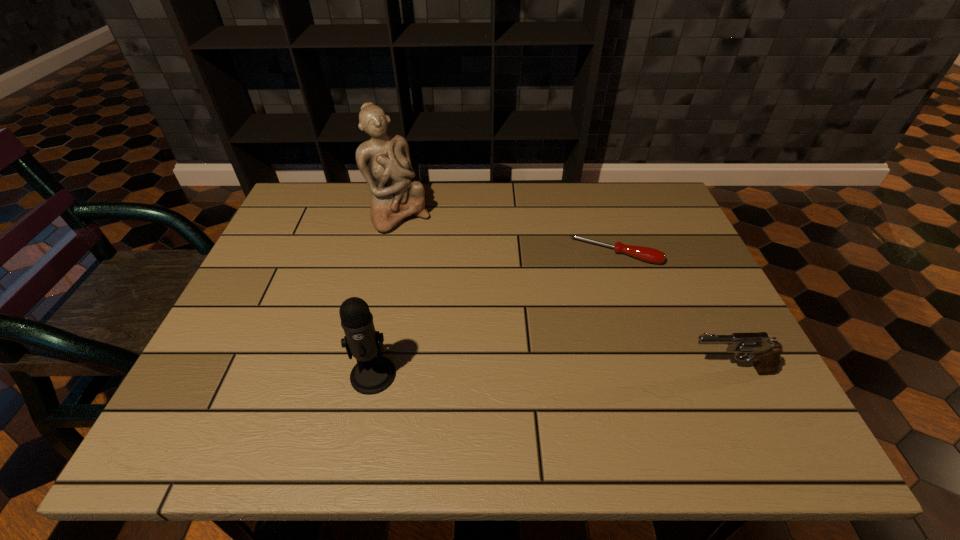
This screenshot has height=540, width=960. What are the coordinates of `vacant position located 0.310m at the tip of the shortest object` in the screenshot? It's located at (571, 357).

Locate an element on the screen. free space located at the tip of the shortest object is located at coordinates (588, 308).

Image resolution: width=960 pixels, height=540 pixels. Identify the location of vacant region located at the tip of the shortest object. (591, 297).

Identify the location of vacant space located on the front-facing side of the farthest object. Image resolution: width=960 pixels, height=540 pixels. (421, 245).

The width and height of the screenshot is (960, 540). I want to click on vacant space located 0.370m on the front-facing side of the farthest object, so click(480, 319).

Identify the location of vacant region located 0.270m on the front-facing side of the farthest object. This screenshot has width=960, height=540. (459, 292).

Locate an element on the screen. This screenshot has height=540, width=960. object that is positioned at the far edge is located at coordinates (384, 161).

Identify the location of microphone present at the near edge. This screenshot has width=960, height=540. (372, 374).

I want to click on pistol positioned at the near edge, so click(766, 354).

Where is `pistol at the right edge`? pistol at the right edge is located at coordinates (766, 354).